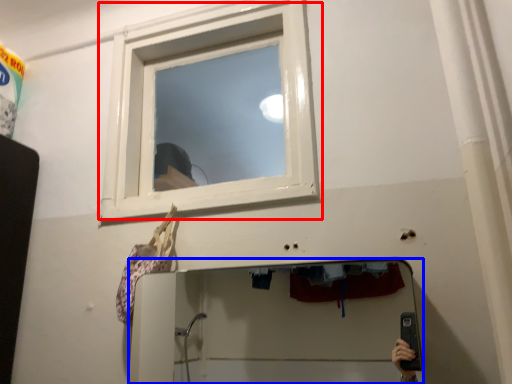
Question: Which object is further to the camera taking this photo, window (highlighted by a red box) or mirror (highlighted by a blue box)?

Choices:
 (A) window
 (B) mirror

Answer: (A)